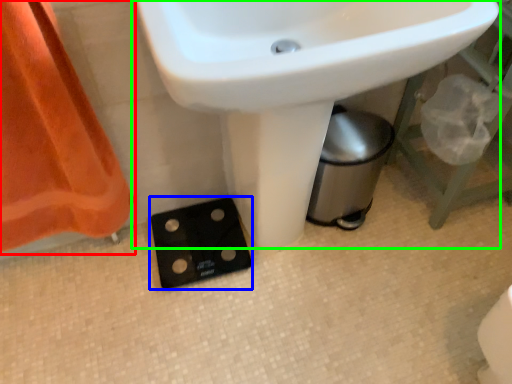
Question: Considering the real-world distances, which object is closest to curtain (highlighted by a red box)? socket (highlighted by a blue box) or sink (highlighted by a green box).

Choices:
 (A) socket
 (B) sink

Answer: (A)